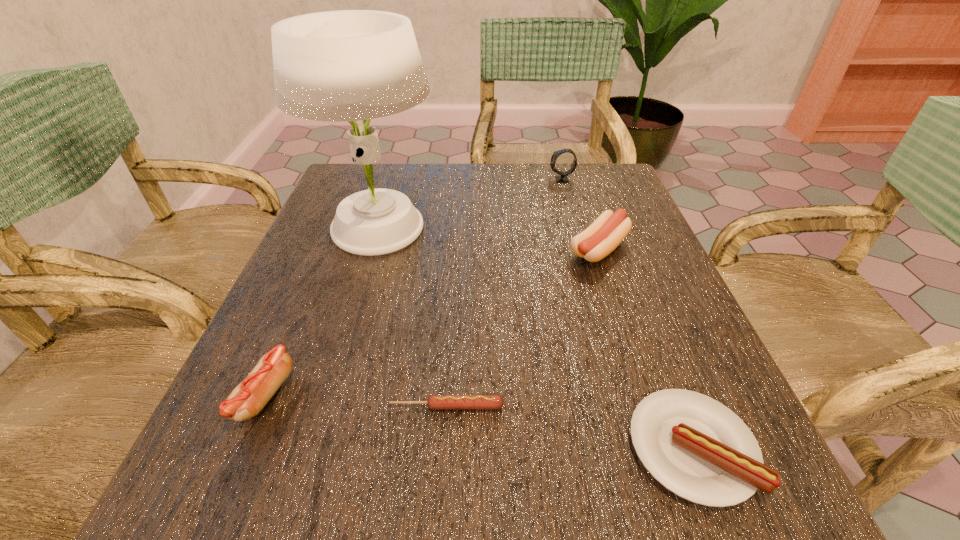
Locate an element on the screen. This screenshot has width=960, height=540. vacant space at the far right corner of the desktop is located at coordinates (606, 186).

Image resolution: width=960 pixels, height=540 pixels. In order to click on vacant point located between the second shortest sausage and the leftmost sausage in this screenshot , I will do `click(478, 422)`.

Identify the location of empty location between the farthest sausage and the leftmost sausage. (432, 322).

The width and height of the screenshot is (960, 540). In order to click on free space between the farthest sausage and the second tallest object in this screenshot , I will do `click(580, 214)`.

The height and width of the screenshot is (540, 960). I want to click on vacant space that is in between the tallest object and the third tallest sausage, so click(535, 339).

At what (x,y) coordinates should I click in order to perform the action: click on vacant space that is in between the shortest object and the leftmost sausage. Please return your answer as a coordinate pair (x, y). The width and height of the screenshot is (960, 540). Looking at the image, I should click on (355, 401).

Where is `vacant space that is in between the shortest object and the fifth tallest object`? vacant space that is in between the shortest object and the fifth tallest object is located at coordinates (569, 427).

Image resolution: width=960 pixels, height=540 pixels. What are the coordinates of `unoccupied area between the second tallest object and the fifth tallest object` in the screenshot? It's located at (626, 314).

Image resolution: width=960 pixels, height=540 pixels. Find the location of `vacant area that lies between the leftmost sausage and the farthest object`. vacant area that lies between the leftmost sausage and the farthest object is located at coordinates (413, 288).

Identify the location of free area in between the leftmost sausage and the third tallest sausage. (478, 422).